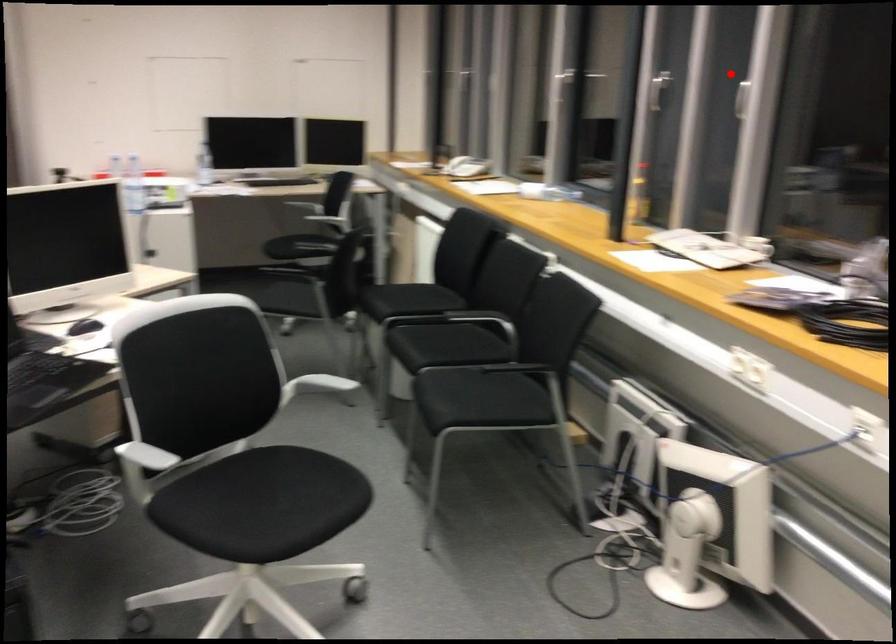
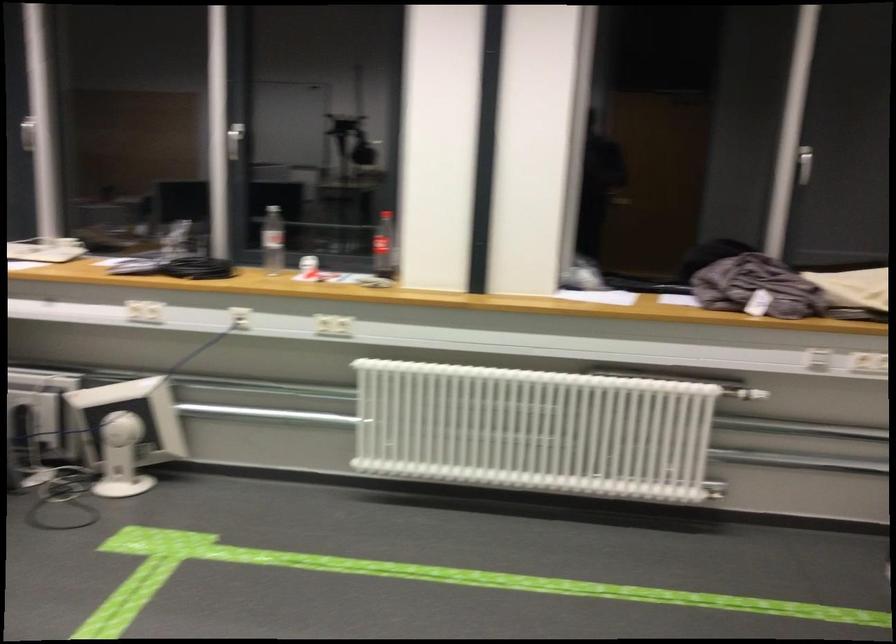
Question: I am providing you with two images of the same scene from different viewpoints. Image1 has a red point marked. In image2, the corresponding 3D location appears at what relative position? Reply with the corresponding letter.

Choices:
 (A) Closer
 (B) Farther

Answer: (B)